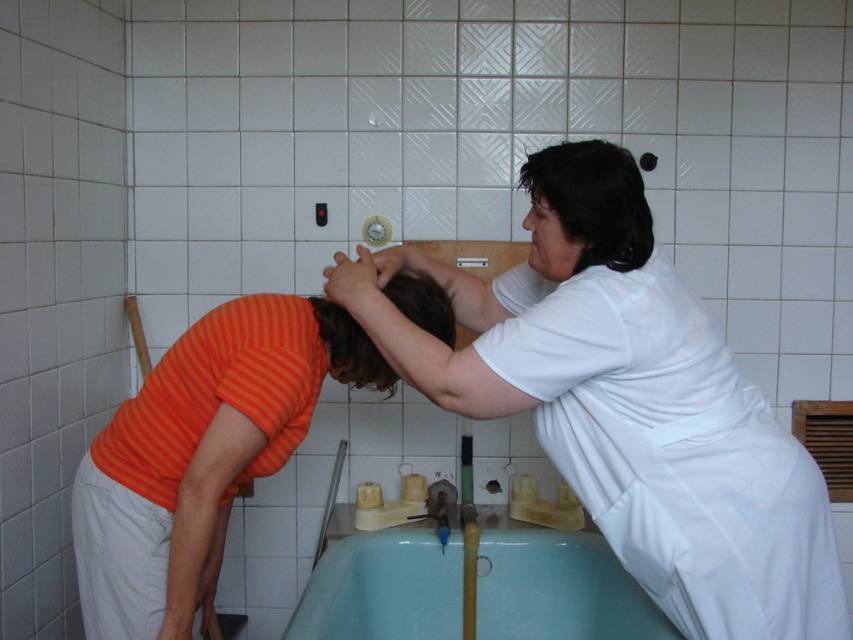
Question: Which of these objects is positioned closest to the black matte hair at upper right?

Choices:
 (A) teal plastic bath at lower center
 (B) orange striped shirt at lower left
 (C) dark brown hair at center
 (D) white matte shirt at upper right

Answer: (D)

Question: Considering the real-world distances, which object is farthest from the orange striped shirt at lower left?

Choices:
 (A) dark brown hair at center
 (B) white matte shirt at upper right

Answer: (B)

Question: Is orange striped shirt at lower left wider than teal plastic bath at lower center?

Choices:
 (A) yes
 (B) no

Answer: (B)

Question: In this image, where is white matte shirt at upper right located relative to black matte hair at upper right?

Choices:
 (A) left
 (B) right

Answer: (B)

Question: Based on their relative distances, which object is nearer to the dark brown hair at center?

Choices:
 (A) teal plastic bath at lower center
 (B) orange striped shirt at lower left

Answer: (B)

Question: Is orange striped shirt at lower left above teal plastic bath at lower center?

Choices:
 (A) yes
 (B) no

Answer: (A)